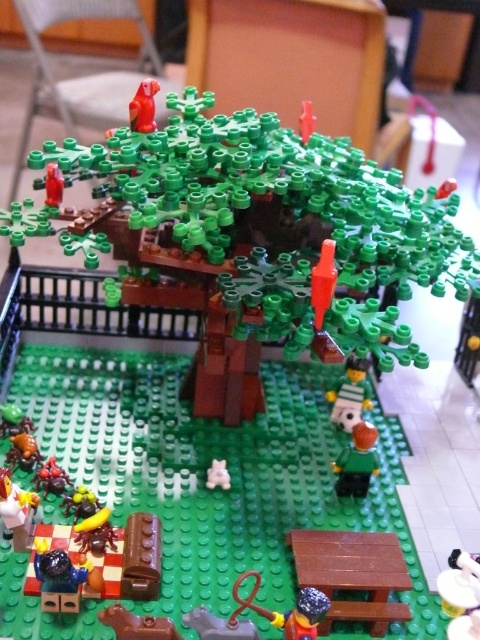
Question: Is shiny blue plastic toy at lower left above brown matte/rough brick at lower center?

Choices:
 (A) yes
 (B) no

Answer: (A)

Question: Is white glossy cup at lower left smaller than brown matte/rough brick at lower center?

Choices:
 (A) no
 (B) yes

Answer: (A)

Question: Estimate the real-world distances between objects in this image. Which object is farther from the green matte tree at center?

Choices:
 (A) brown matte/rough brick at lower center
 (B) green matte figure at lower center
 (C) white glossy cup at lower left
 (D) rubberized brown boot at lower left

Answer: (A)

Question: Which point is closer to the camera taking this photo?

Choices:
 (A) (134, 620)
 (B) (307, 609)

Answer: (B)

Question: Where is brown matte/rough brick at lower center located in relation to smooth white soccer ball at center in the image?

Choices:
 (A) below
 (B) above

Answer: (A)

Question: Which is farther from the smooth red figurine at upper left?

Choices:
 (A) green matte tree at center
 (B) rubberized brown boot at lower left
 (C) white glossy cup at lower left
 (D) shiny blue plastic toy at lower left

Answer: (D)